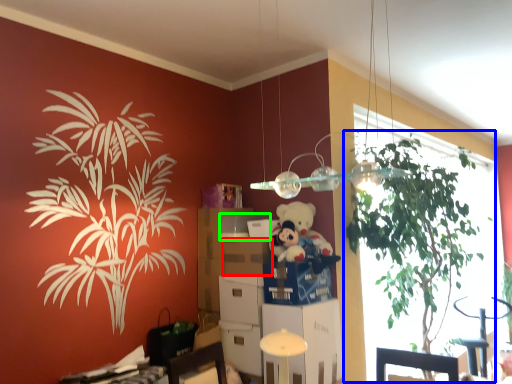
Question: Which object is the farthest from drawer (highlighted by a red box)? Choose among these: houseplant (highlighted by a blue box) or box (highlighted by a green box).

Choices:
 (A) houseplant
 (B) box

Answer: (A)